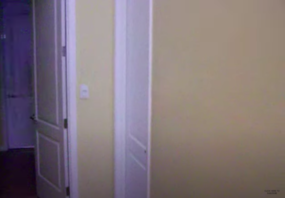
Where is `doors`? doors is located at coordinates (22, 60), (47, 88), (134, 104).